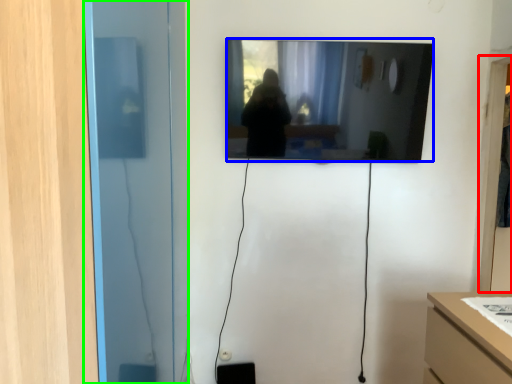
Question: Considering the real-world distances, which object is closest to glass door (highlighted by a red box)? mirror (highlighted by a blue box) or glass door (highlighted by a green box).

Choices:
 (A) mirror
 (B) glass door

Answer: (A)